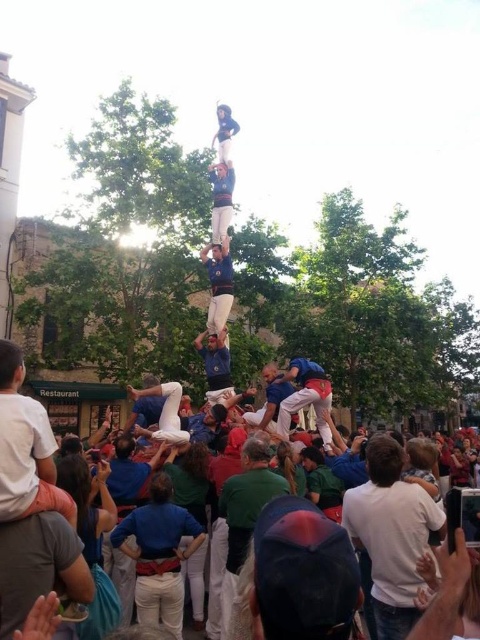
Question: Which is farther from the white cotton shirt at center?

Choices:
 (A) blue fabric man at center
 (B) white cotton shirt at lower left

Answer: (B)

Question: Does white cotton crowd at lower center have a greater width compared to blue fabric at center?

Choices:
 (A) yes
 (B) no

Answer: (A)

Question: Which point appears farthest from the camera in this image?

Choices:
 (A) (208, 307)
 (B) (7, 342)

Answer: (A)

Question: From the image, what is the correct spatial relationship of white cotton crowd at lower center in relation to blue fabric at center?

Choices:
 (A) below
 (B) above

Answer: (A)

Question: Observing the image, what is the correct spatial positioning of white cotton shirt at lower left in reference to blue fabric man at center?

Choices:
 (A) right
 (B) left

Answer: (B)

Question: Which object is the closest to the white cotton shirt at lower left?

Choices:
 (A) blue fabric person at center
 (B) white cotton shirt at center

Answer: (B)